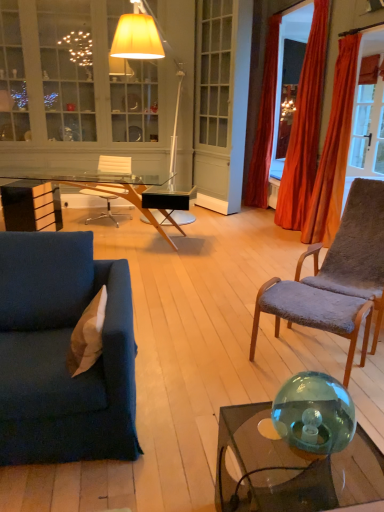
This screenshot has height=512, width=384. In order to click on vacant space in transparent glass sphere at lower right (from a real-world perspective) in this screenshot , I will do `click(307, 452)`.